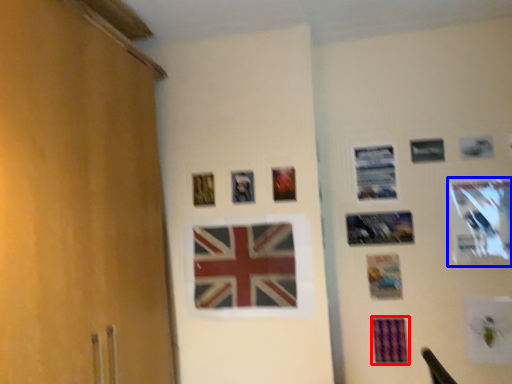
Question: Which object is further to the camera taking this photo, postcard (highlighted by a red box) or picture frame (highlighted by a blue box)?

Choices:
 (A) postcard
 (B) picture frame

Answer: (A)